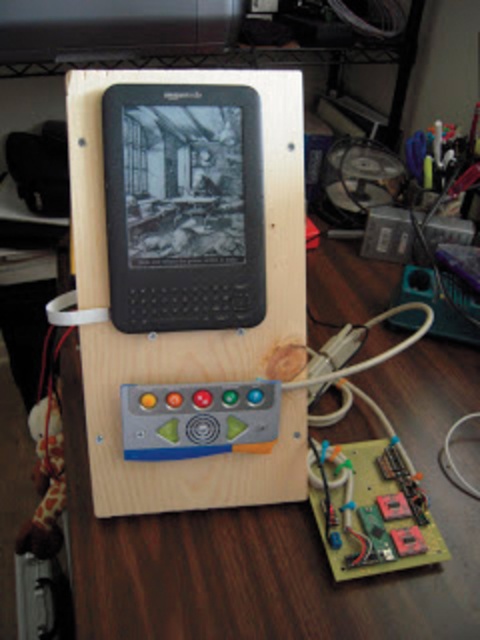
Question: Among these points, which one is farthest from the camera?

Choices:
 (A) (190, 237)
 (B) (453, 513)

Answer: (B)

Question: Observing the image, what is the correct spatial positioning of wooden at center in reference to black matte e-reader at center?

Choices:
 (A) right
 (B) left

Answer: (A)

Question: Which is nearer to the black matte e-reader at center?

Choices:
 (A) green circuit board at center
 (B) wooden at center

Answer: (A)

Question: Among these points, which one is nearest to the camera?

Choices:
 (A) 425,548
 (B) 227,109
 (C) 343,269

Answer: (B)

Question: Is wooden at center below green circuit board at center?

Choices:
 (A) no
 (B) yes

Answer: (A)

Question: Does wooden at center appear over green circuit board at center?

Choices:
 (A) yes
 (B) no

Answer: (A)